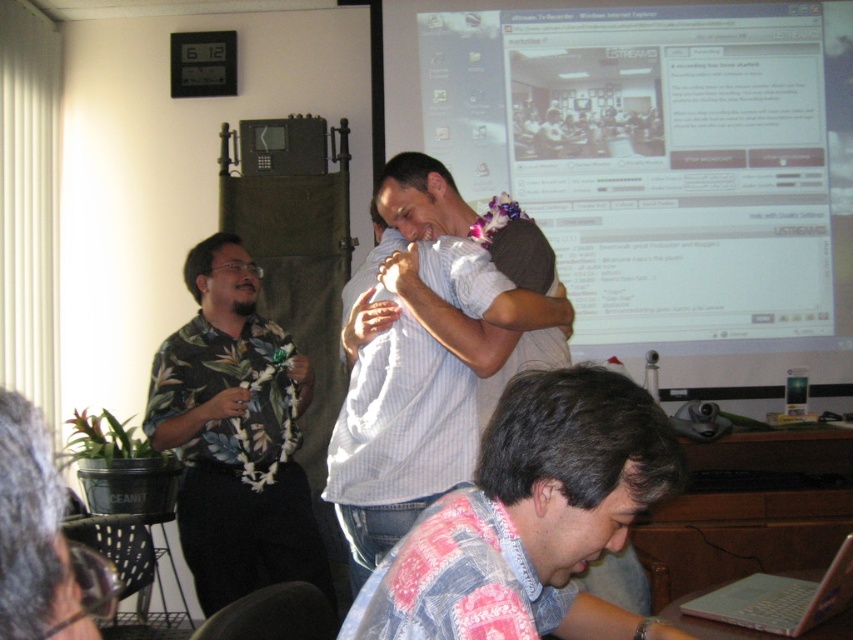
You are standing in the conference room and need to locate the white glossy projection screen at upper center. According to the coordinates provided, where exactly should you look?

The white glossy projection screen at upper center is located at point coordinates (656, 168).